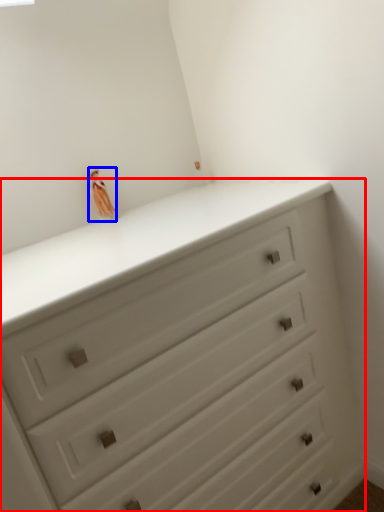
Question: Among these objects, which one is farthest to the camera, chest of drawers (highlighted by a red box) or miniature (highlighted by a blue box)?

Choices:
 (A) chest of drawers
 (B) miniature

Answer: (B)